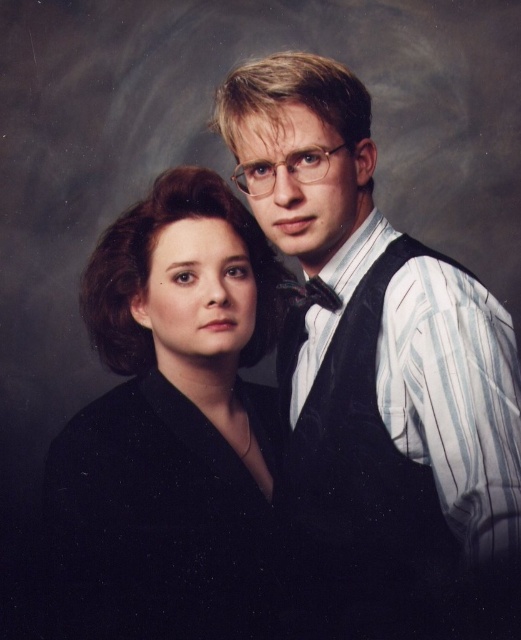
Question: Is matte black vest at right positioned in front of shiny black bow tie at center?

Choices:
 (A) no
 (B) yes

Answer: (B)

Question: Does black fabric at center appear under shiny black bow tie at center?

Choices:
 (A) yes
 (B) no

Answer: (A)

Question: Which point appears closest to the camera in this image?

Choices:
 (A) (448, 440)
 (B) (292, 307)
 (C) (92, 586)

Answer: (A)

Question: Estimate the real-world distances between objects in this image. Which object is closer to the shiny black bow tie at center?

Choices:
 (A) matte black vest at right
 (B) black fabric at center

Answer: (A)

Question: Which point appears farthest from the camera in this image?

Choices:
 (A) (126, 465)
 (B) (513, 385)

Answer: (A)

Question: Can you confirm if matte black vest at right is wider than shiny black bow tie at center?

Choices:
 (A) no
 (B) yes

Answer: (B)